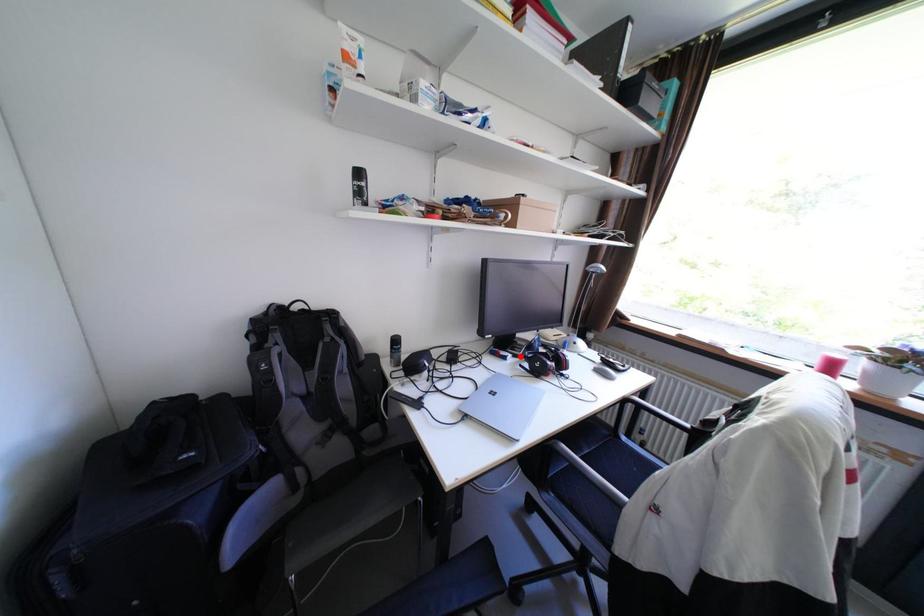
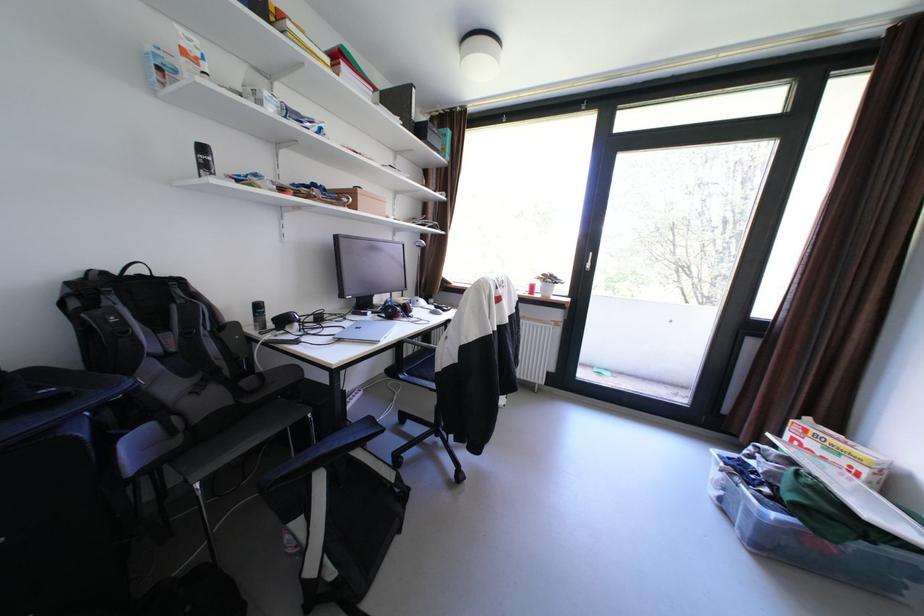
In the second image, find the point that corresponds to the highlighted location in the first image.

(380, 313)